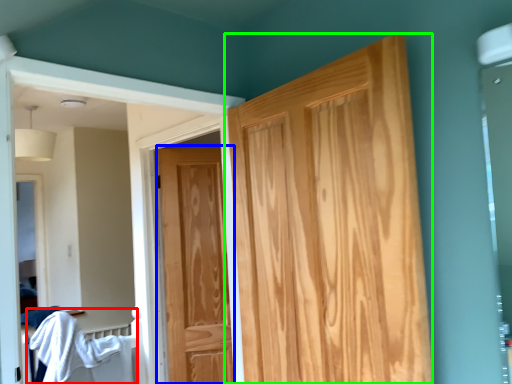
Question: Based on their relative distances, which object is nearer to bed (highlighted by a red box)? Choose from door (highlighted by a blue box) and door (highlighted by a green box).

Choices:
 (A) door
 (B) door

Answer: (A)